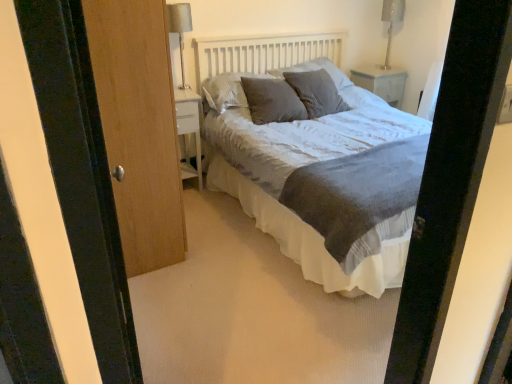
You are a GUI agent. You are given a task and a screenshot of the screen. Output one action in this format:
    pyautogui.click(x=<x>, y=<y>)
    Task: Click on the free space in front of white glossy nightstand at left, placed as the second nightstand when sorted from right to left
    This screenshot has width=512, height=384.
    Given the screenshot: What is the action you would take?
    pyautogui.click(x=200, y=205)